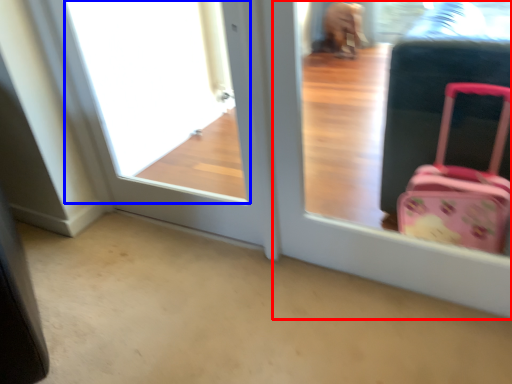
Question: Which object appears farthest to the camera in this image, screen door (highlighted by a red box) or window frame (highlighted by a blue box)?

Choices:
 (A) screen door
 (B) window frame

Answer: (B)